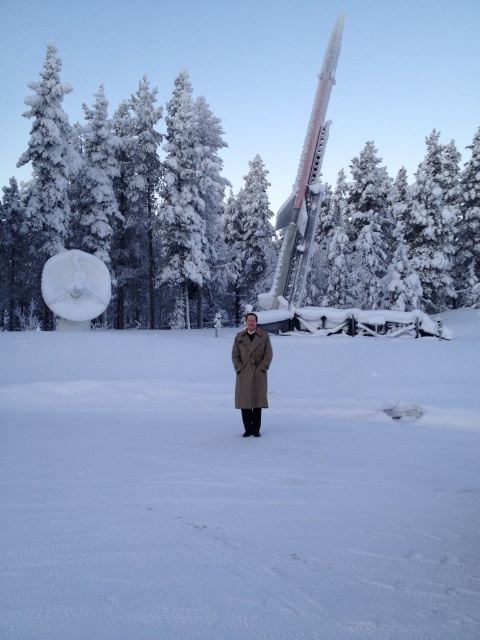
Based on the photo, you are a photographer who wants to take a picture of the shiny metallic rocket at center from the man in the beige coat. Where should you position the camera relative to the man to capture the rocket in the frame?

The shiny metallic rocket at center is located at point (x=304, y=192), so you should position the camera directly in front of the man in the beige coat to capture the rocket in the frame since it is centered in the image.